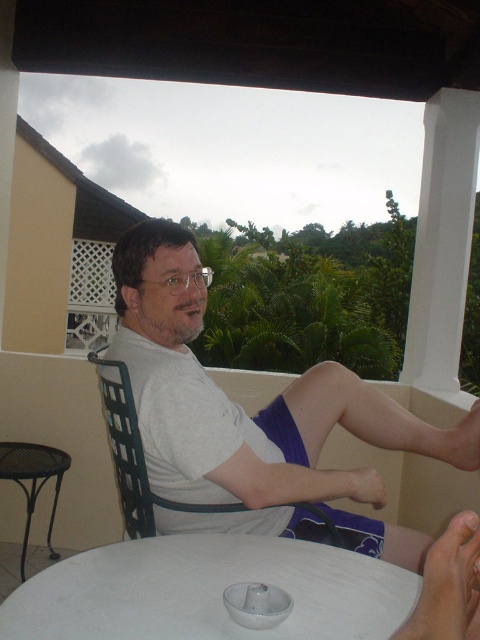
Is point (175, 424) positioned before point (134, 605)?

No, (175, 424) is behind (134, 605).

What are the coordinates of `white cotton shirt at center` in the screenshot? It's located at pos(242,410).

You are a GUI agent. You are given a task and a screenshot of the screen. Output one action in this format:
    pyautogui.click(x=<x>, y=<y>)
    Task: Click on the white cotton shirt at center
    Image resolution: width=480 pixels, height=640 pixels.
    Given the screenshot: What is the action you would take?
    pyautogui.click(x=242, y=410)

Between black plastic chair at center and black metal table at lower left, which one has more height?

black metal table at lower left is taller.

Does black plastic chair at center have a lesser width compared to black metal table at lower left?

No, black plastic chair at center is not thinner than black metal table at lower left.

What do you see at coordinates (135, 456) in the screenshot? Image resolution: width=480 pixels, height=640 pixels. I see `black plastic chair at center` at bounding box center [135, 456].

At what (x,y) coordinates should I click in order to perform the action: click on black plastic chair at center. Please return your answer as a coordinate pair (x, y). The height and width of the screenshot is (640, 480). Looking at the image, I should click on (135, 456).

Which is above, white matte round table at center or black metal table at lower left?

white matte round table at center

Can you confirm if white matte round table at center is taller than black metal table at lower left?

In fact, white matte round table at center may be shorter than black metal table at lower left.

Measure the distance between white matte round table at center and camera.

white matte round table at center and camera are 85.37 centimeters apart.

In order to click on white matte round table at center in this screenshot , I will do `click(207, 592)`.